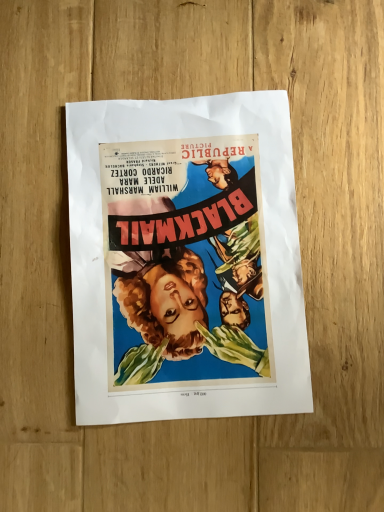
Image resolution: width=384 pixels, height=512 pixels. I want to click on empty space that is ontop of matte paper poster at center (from a real-world perspective), so click(x=189, y=246).